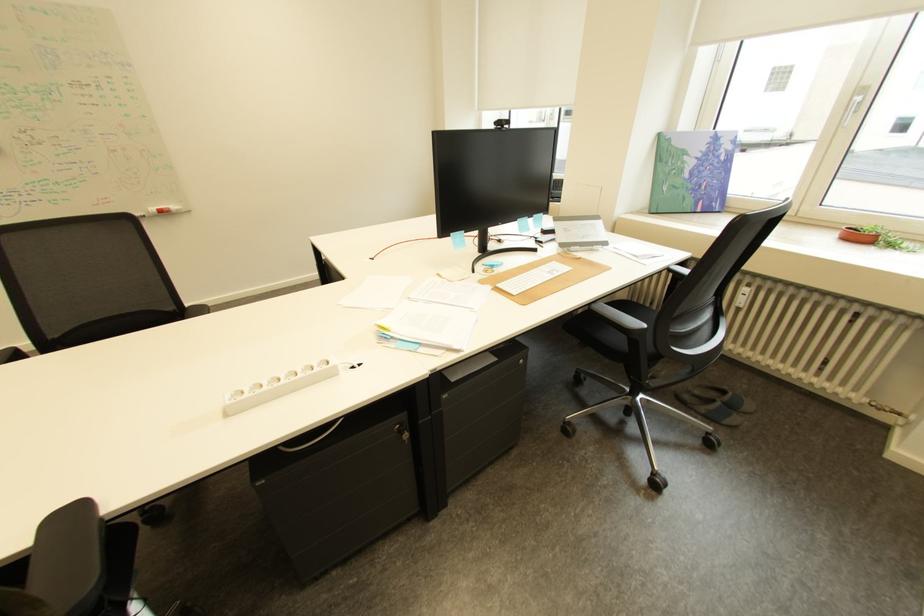
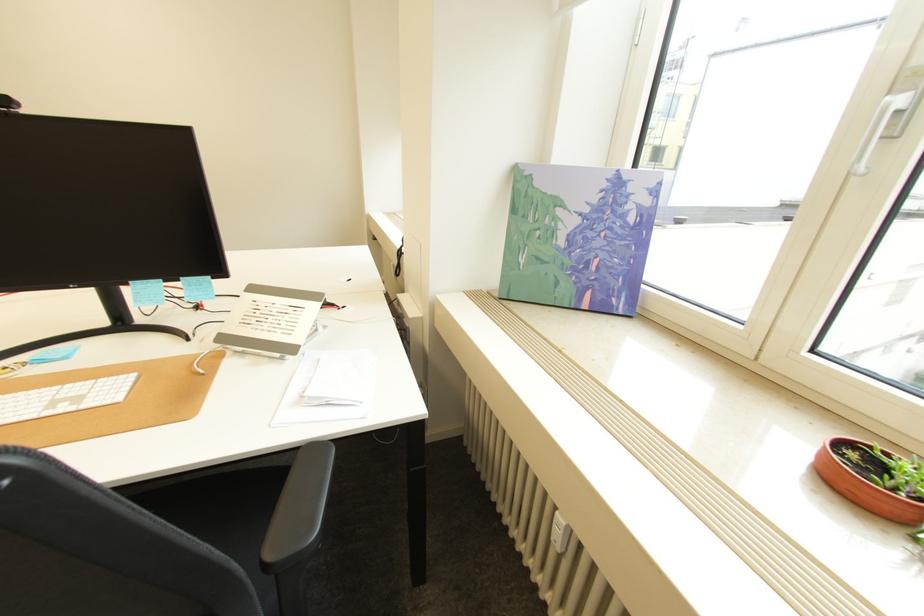
What movement of the cameraman would produce the second image?

The movement direction of the cameraman is right, forward.